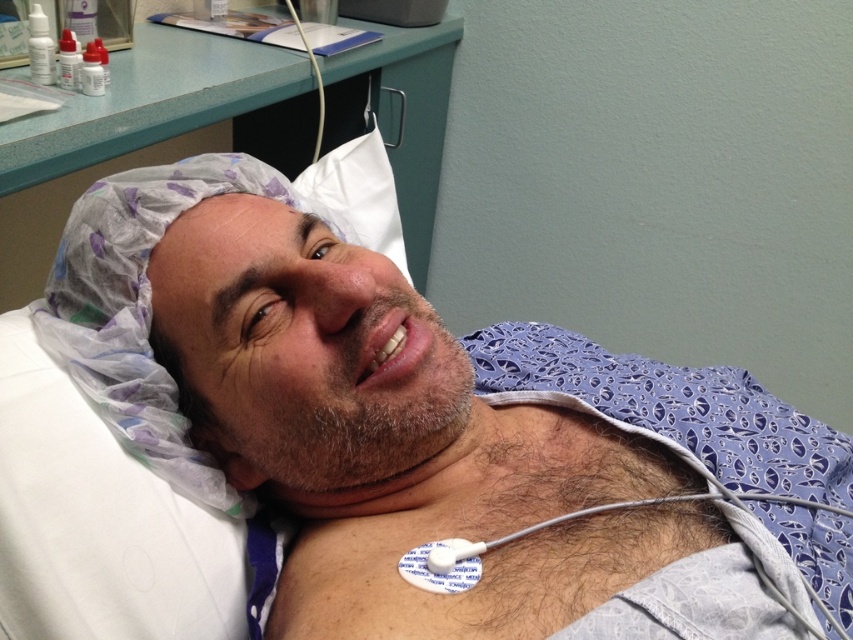
You are a medical professional in the room. You need to place a new medical device on the white fabric at center. What are the coordinates where you should place it?

The coordinates for placing the new medical device on the white fabric at center are at point (x=428, y=433).

You are a medical technician in a hospital room. You need to place a new medical device on the white fabric at center. The device requires a minimum of 20 inches of space from the camera to function properly. Can you safely place the device there?

The distance between the white fabric at center and the camera is 19.62 inches, which is less than the required 20 inches. Therefore, placing the device there may compromise its functionality. Consider adjusting the position to ensure adequate space.

You are a medical technician in a hospital room. You need to reach two points marked in the scene. The first point is at coordinate point (759, 620) and the second is at point (195, 42). Which point should you approach first if you want to reach the closer one to your current position?

Point (759, 620) is closer to the viewer than point (195, 42), so you should approach point (759, 620) first.